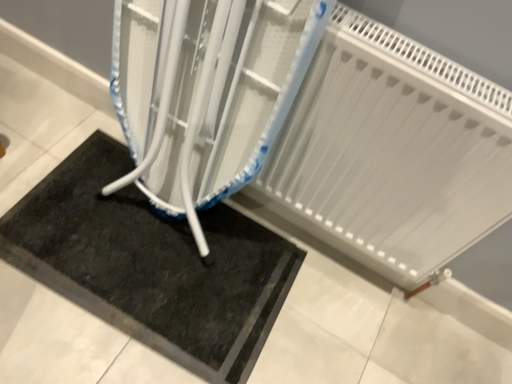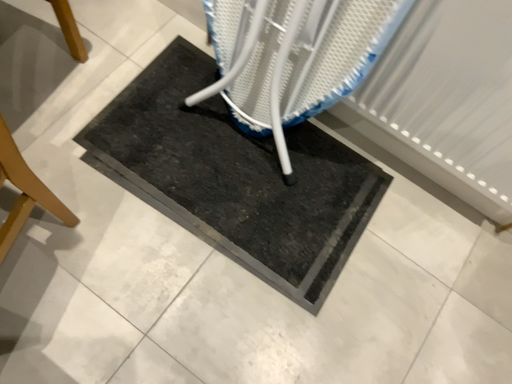
Question: How did the camera likely rotate when shooting the video?

Choices:
 (A) rotated upward
 (B) rotated downward

Answer: (B)